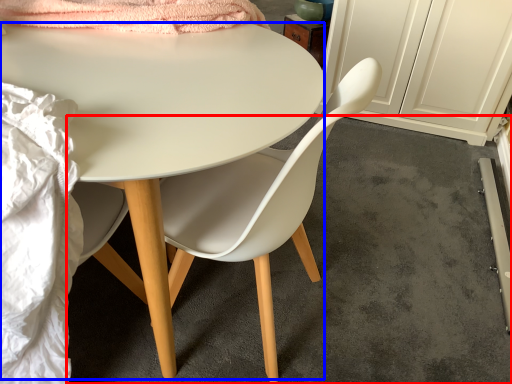
Question: Which of the following is the closest to the observer, concrete (highlighted by a red box) or desk (highlighted by a blue box)?

Choices:
 (A) concrete
 (B) desk

Answer: (B)